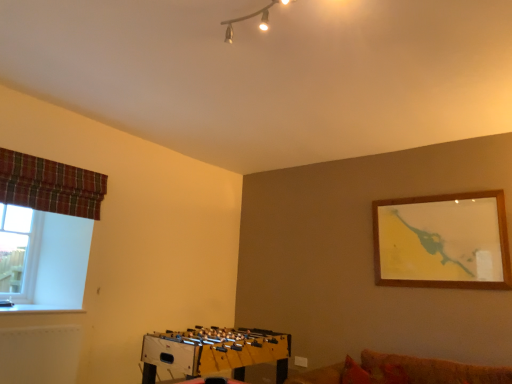
Question: Can you confirm if plaid fabric curtain at left is wider than wooden foosball table at lower center?

Choices:
 (A) no
 (B) yes

Answer: (A)

Question: Does plaid fabric curtain at left come behind wooden foosball table at lower center?

Choices:
 (A) yes
 (B) no

Answer: (A)

Question: From a real-world perspective, is plaid fabric curtain at left beneath wooden foosball table at lower center?

Choices:
 (A) yes
 (B) no

Answer: (B)

Question: Does plaid fabric curtain at left appear on the left side of wooden foosball table at lower center?

Choices:
 (A) yes
 (B) no

Answer: (A)

Question: From a real-world perspective, is plaid fabric curtain at left over wooden foosball table at lower center?

Choices:
 (A) no
 (B) yes

Answer: (B)

Question: Can you confirm if plaid fabric curtain at left is taller than wooden foosball table at lower center?

Choices:
 (A) yes
 (B) no

Answer: (B)

Question: Could you tell me if metallic track lighting at upper center is facing plaid fabric curtain at left?

Choices:
 (A) yes
 (B) no

Answer: (B)

Question: Can you confirm if metallic track lighting at upper center is bigger than plaid fabric curtain at left?

Choices:
 (A) yes
 (B) no

Answer: (B)

Question: Is plaid fabric curtain at left at the back of metallic track lighting at upper center?

Choices:
 (A) yes
 (B) no

Answer: (A)

Question: Is metallic track lighting at upper center positioned far away from plaid fabric curtain at left?

Choices:
 (A) yes
 (B) no

Answer: (A)

Question: Can you confirm if metallic track lighting at upper center is positioned to the right of plaid fabric curtain at left?

Choices:
 (A) no
 (B) yes

Answer: (B)

Question: Is metallic track lighting at upper center positioned behind plaid fabric curtain at left?

Choices:
 (A) yes
 (B) no

Answer: (B)

Question: Are wooden foosball table at lower center and metallic track lighting at upper center located far from each other?

Choices:
 (A) no
 (B) yes

Answer: (B)